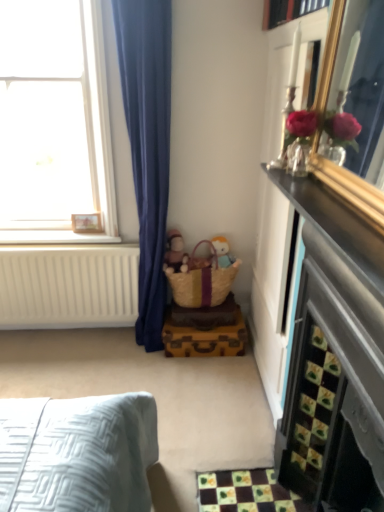
Question: Considering the relative positions of yellow woven basket at center and soft plush toy at center in the image provided, is yellow woven basket at center to the left of soft plush toy at center from the viewer's perspective?

Choices:
 (A) no
 (B) yes

Answer: (B)

Question: Is the depth of yellow woven basket at center greater than that of soft plush toy at center?

Choices:
 (A) no
 (B) yes

Answer: (A)

Question: From the image's perspective, is yellow woven basket at center on top of soft plush toy at center?

Choices:
 (A) no
 (B) yes

Answer: (A)

Question: Considering the relative sizes of yellow woven basket at center and soft plush toy at center in the image provided, is yellow woven basket at center bigger than soft plush toy at center?

Choices:
 (A) no
 (B) yes

Answer: (B)

Question: Does yellow woven basket at center have a greater height compared to soft plush toy at center?

Choices:
 (A) yes
 (B) no

Answer: (A)

Question: In terms of width, does yellow woven basket at center look wider or thinner when compared to wooden picture frame at upper left?

Choices:
 (A) thin
 (B) wide

Answer: (B)

Question: In terms of height, does yellow woven basket at center look taller or shorter compared to wooden picture frame at upper left?

Choices:
 (A) short
 (B) tall

Answer: (B)

Question: From a real-world perspective, relative to wooden picture frame at upper left, is yellow woven basket at center vertically above or below?

Choices:
 (A) above
 (B) below

Answer: (B)

Question: Visually, is yellow woven basket at center positioned to the left or to the right of wooden picture frame at upper left?

Choices:
 (A) right
 (B) left

Answer: (A)

Question: Is point (86, 224) closer or farther from the camera than point (31, 237)?

Choices:
 (A) closer
 (B) farther

Answer: (B)

Question: Would you say wooden picture frame at upper left is to the left or to the right of white painted wood at left in the picture?

Choices:
 (A) right
 (B) left

Answer: (A)

Question: Is wooden picture frame at upper left wider or thinner than white painted wood at left?

Choices:
 (A) thin
 (B) wide

Answer: (A)

Question: Is wooden picture frame at upper left situated inside white painted wood at left or outside?

Choices:
 (A) outside
 (B) inside

Answer: (A)

Question: In the image, is matte brown doll at center positioned in front of or behind yellow woven basket at center?

Choices:
 (A) behind
 (B) front

Answer: (A)

Question: Considering the positions of matte brown doll at center and yellow woven basket at center in the image, is matte brown doll at center wider or thinner than yellow woven basket at center?

Choices:
 (A) thin
 (B) wide

Answer: (A)